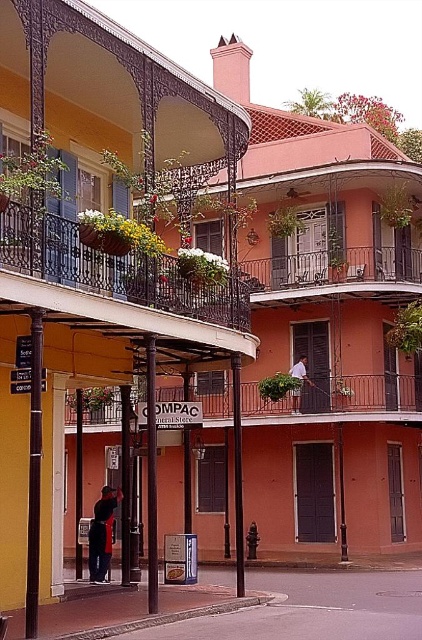
Question: Is dark blue fabric jacket at center wider than brown wooden pillar at center?

Choices:
 (A) yes
 (B) no

Answer: (A)

Question: Estimate the real-world distances between objects in this image. Which object is closer to the rustic wood balcony at center?

Choices:
 (A) white cotton shirt at center
 (B) matte black wrought iron balcony at upper left

Answer: (A)

Question: Which object is positioned closest to the metallic pole at center?

Choices:
 (A) dark blue fabric jacket at center
 (B) rustic wood balcony at center
 (C) brown wooden pillar at center
 (D) matte black wrought iron balcony at upper left

Answer: (C)

Question: Which object is farther from the camera taking this photo?

Choices:
 (A) rustic wood balcony at center
 (B) brown wooden pillar at center
 (C) pavement at lower center

Answer: (A)

Question: Considering the relative positions of matte black wrought iron balcony at upper left and pavement at lower center in the image provided, where is matte black wrought iron balcony at upper left located with respect to pavement at lower center?

Choices:
 (A) below
 (B) above

Answer: (B)

Question: Can you confirm if metallic wrought iron balcony at center is smaller than white cotton shirt at center?

Choices:
 (A) yes
 (B) no

Answer: (B)